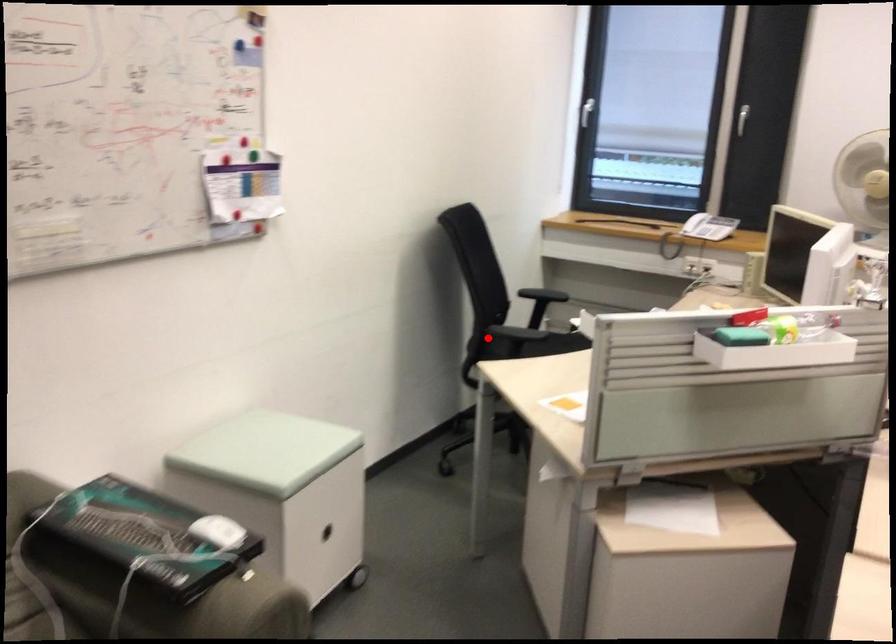
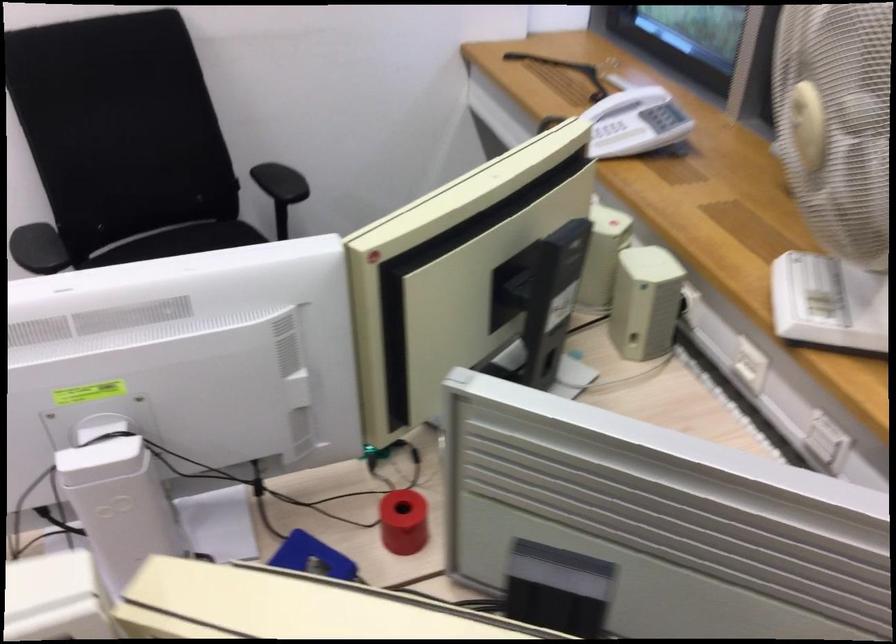
Question: I am providing you with two images of the same scene from different viewpoints. Image1 has a red point marked. In image2, the corresponding 3D location appears at what relative position? Reply with the corresponding letter.

Choices:
 (A) Closer
 (B) Farther

Answer: (A)